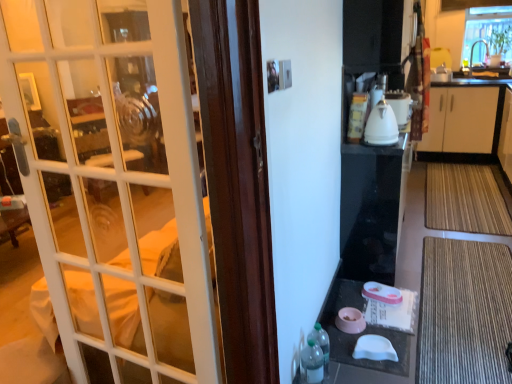
The width and height of the screenshot is (512, 384). What are the coordinates of `blank space above brown textured mat at lower right, acting as the second doormat starting from the back (from a real-world perspective)` in the screenshot? It's located at pyautogui.click(x=448, y=315).